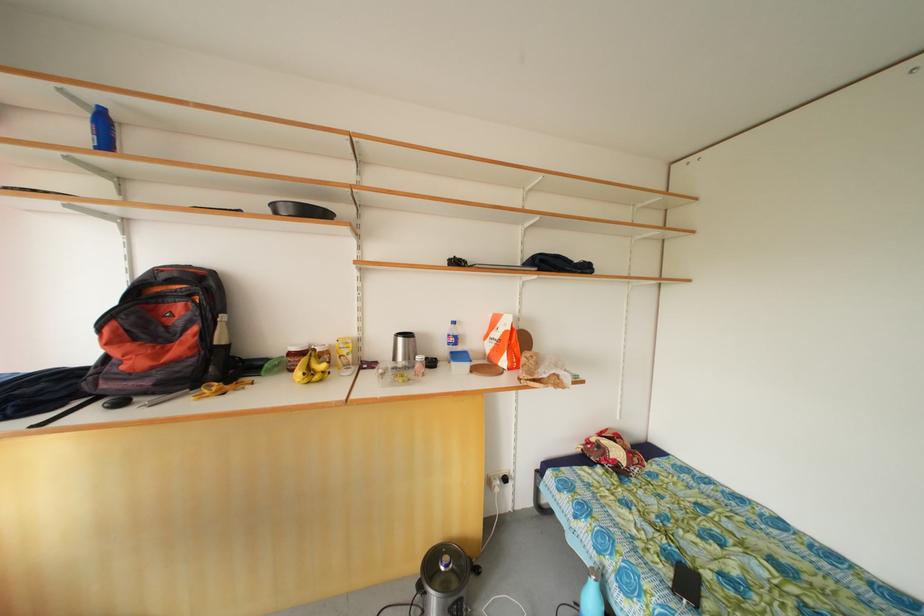
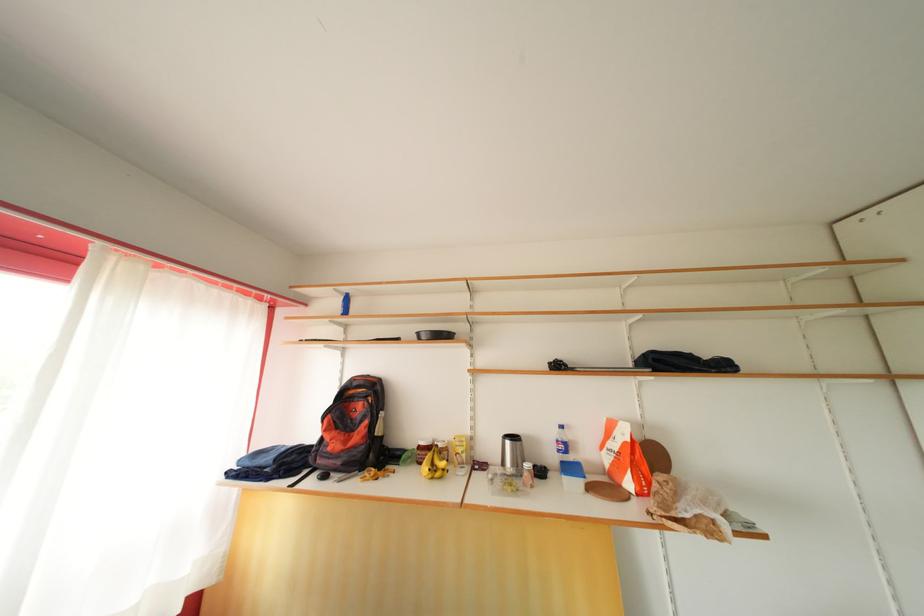
The point at (458, 346) is marked in the first image. Where is the corresponding point in the second image?

(568, 453)